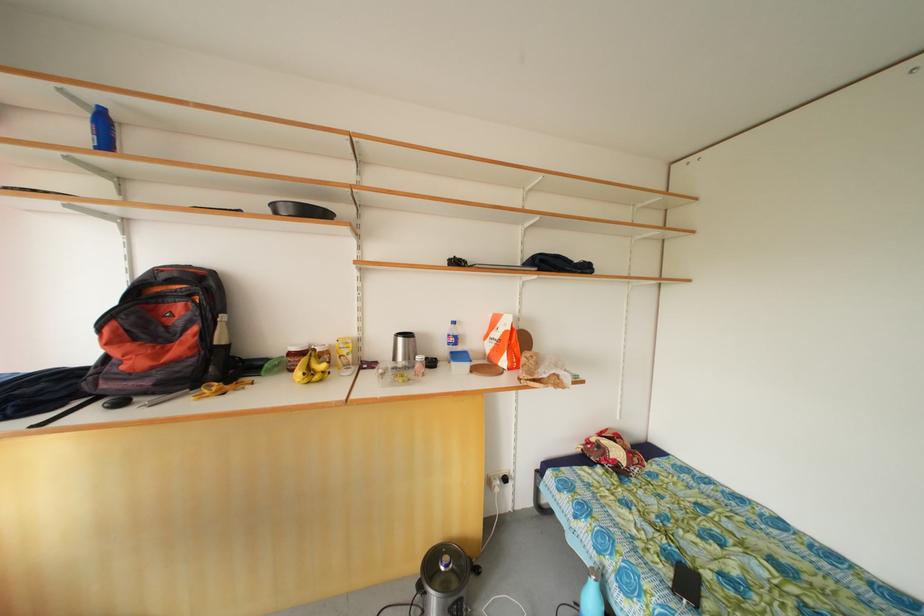
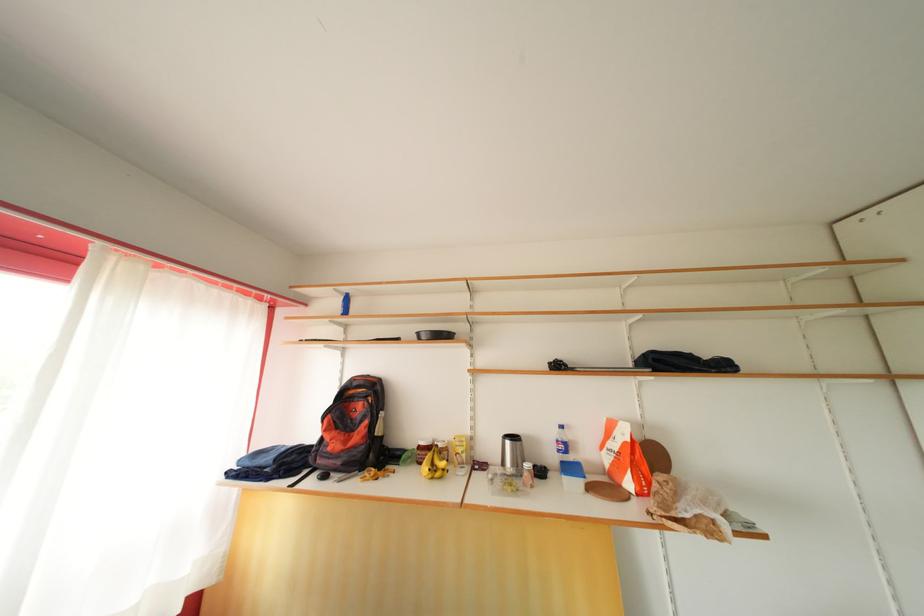
The point at (458, 346) is marked in the first image. Where is the corresponding point in the second image?

(568, 453)